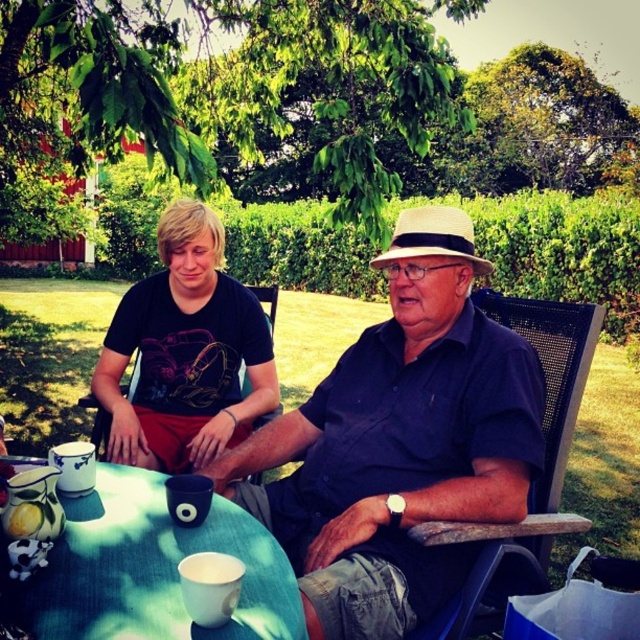
You are a guest at this garden table and need to sit down. There are two chairs available. The black mesh chair at center and the black plastic chair at left. Which chair is positioned to the right side of the table?

The black mesh chair at center is positioned to the right of the black plastic chair at left, so the black mesh chair at center is to the right side of the table.

You are a photographer setting up a shoot in the garden scene. You need to ensure that the matte blue shirt at center and the green fabric table at center are both visible in the frame. Given their sizes, which object will require more space in the composition?

The matte blue shirt at center has a larger size compared to the green fabric table at center, so it will require more space in the composition.